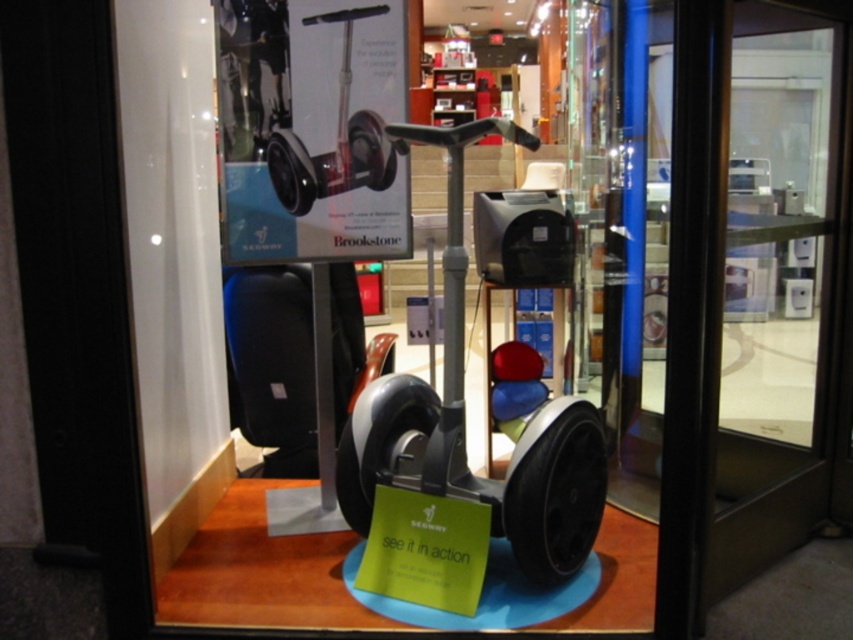
You are standing in front of the storefront display. You want to locate the metallic gray hoverboard at center. Where is it positioned relative to the Segway PT?

The metallic gray hoverboard at center is positioned at point coordinates (212, 360) relative to the Segway PT.

You are a customer standing in front of the storefront display. You see the metallic gray hoverboard at center and the matte gray scooter at center. Which object is placed above the other?

The metallic gray hoverboard at center is positioned over the matte gray scooter at center.